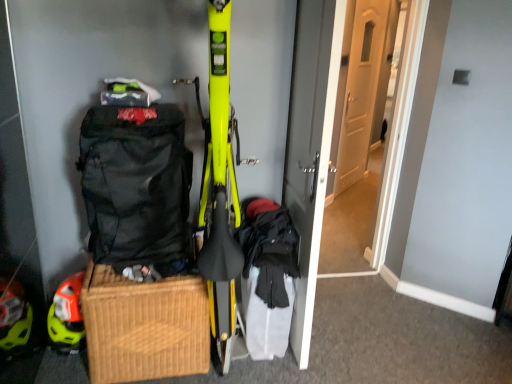
Measure the distance between white wooden door at center, which appears as the first door when viewed from the right, and camera.

8.27 feet.

In order to click on woven brown picnic basket at lower left in this screenshot , I will do `click(144, 326)`.

How much space does matte gray door at center, which is counted as the 1th door, starting from the left, occupy vertically?

matte gray door at center, which is counted as the 1th door, starting from the left, is 1.75 meters tall.

I want to click on orange matte helmet at lower left, so click(x=67, y=316).

Does white wooden door at center, which appears as the second door when viewed from the left, have a lesser height compared to matte gray door at center, which is counted as the 1th door, starting from the left?

No.

Who is more distant, white wooden door at center, which appears as the second door when viewed from the left, or matte gray door at center, which ranks as the 2th door in right-to-left order?

white wooden door at center, which appears as the second door when viewed from the left, is behind.

Which of these two, white wooden door at center, which appears as the second door when viewed from the left, or matte gray door at center, which is counted as the 1th door, starting from the left, is bigger?

matte gray door at center, which is counted as the 1th door, starting from the left, is bigger.

Are white wooden door at center, which appears as the second door when viewed from the left, and matte gray door at center, which ranks as the 2th door in right-to-left order, far apart?

Yes, white wooden door at center, which appears as the second door when viewed from the left, and matte gray door at center, which ranks as the 2th door in right-to-left order, are quite far apart.

Where is `backpack above the woven brown picnic basket at lower left (from the image's perspective)`? backpack above the woven brown picnic basket at lower left (from the image's perspective) is located at coordinates (137, 187).

Considering the relative positions of black fabric backpack at left and woven brown picnic basket at lower left in the image provided, is black fabric backpack at left in front of woven brown picnic basket at lower left?

Yes, black fabric backpack at left is closer to the viewer.

In terms of height, does black fabric backpack at left look taller or shorter compared to woven brown picnic basket at lower left?

black fabric backpack at left is taller than woven brown picnic basket at lower left.

Is black fabric backpack at left not within woven brown picnic basket at lower left?

Yes, black fabric backpack at left is located beyond the bounds of woven brown picnic basket at lower left.

How different are the orientations of matte gray door at center, which is counted as the 1th door, starting from the left, and orange matte helmet at lower left in degrees?

matte gray door at center, which is counted as the 1th door, starting from the left, and orange matte helmet at lower left are facing 87.1 degrees away from each other.

Does point (335, 11) come behind point (68, 348)?

That is False.

From a real-world perspective, between matte gray door at center, which is counted as the 1th door, starting from the left, and orange matte helmet at lower left, who is vertically higher?

In real-world perspective, matte gray door at center, which is counted as the 1th door, starting from the left, is above.

Can you confirm if matte gray door at center, which ranks as the 2th door in right-to-left order, is positioned to the right of orange matte helmet at lower left?

Yes, matte gray door at center, which ranks as the 2th door in right-to-left order, is to the right of orange matte helmet at lower left.

Is orange matte helmet at lower left aimed at white wooden door at center, which appears as the first door when viewed from the right?

No, orange matte helmet at lower left is not facing towards white wooden door at center, which appears as the first door when viewed from the right.

Which of these two, orange matte helmet at lower left or white wooden door at center, which appears as the first door when viewed from the right, is smaller?

With smaller size is orange matte helmet at lower left.

Which of these two, orange matte helmet at lower left or white wooden door at center, which appears as the first door when viewed from the right, stands shorter?

orange matte helmet at lower left.

From their relative heights in the image, would you say white wooden door at center, which appears as the first door when viewed from the right, is taller or shorter than black fabric backpack at left?

white wooden door at center, which appears as the first door when viewed from the right, is taller than black fabric backpack at left.

Is white wooden door at center, which appears as the first door when viewed from the right, positioned before black fabric backpack at left?

That is False.

Looking at the image, does white wooden door at center, which appears as the first door when viewed from the right, seem bigger or smaller compared to black fabric backpack at left?

white wooden door at center, which appears as the first door when viewed from the right, is bigger than black fabric backpack at left.

From the image's perspective, is white wooden door at center, which appears as the first door when viewed from the right, located beneath black fabric backpack at left?

Actually, white wooden door at center, which appears as the first door when viewed from the right, appears above black fabric backpack at left in the image.

Is black fabric backpack at left with orange matte helmet at lower left?

No.

Based on the photo, which object is thinner, black fabric backpack at left or orange matte helmet at lower left?

orange matte helmet at lower left is thinner.

Does black fabric backpack at left have a lesser height compared to orange matte helmet at lower left?

Incorrect, the height of black fabric backpack at left does not fall short of that of orange matte helmet at lower left.

Find the location of a particular element. backpack located in front of the orange matte helmet at lower left is located at coordinates (137, 187).

Who is smaller, orange matte helmet at lower left or black fabric backpack at left?

With smaller size is orange matte helmet at lower left.

Could black fabric backpack at left be considered to be inside orange matte helmet at lower left?

That's incorrect, black fabric backpack at left is not inside orange matte helmet at lower left.

From the image's perspective, is orange matte helmet at lower left beneath black fabric backpack at left?

Indeed, from the image's perspective, orange matte helmet at lower left is shown beneath black fabric backpack at left.

From a real-world perspective, which is physically below, orange matte helmet at lower left or black fabric backpack at left?

From a 3D spatial view, orange matte helmet at lower left is below.

Locate an element on the screen. This screenshot has width=512, height=384. door below the white wooden door at center, which appears as the first door when viewed from the right (from a real-world perspective) is located at coordinates (311, 147).

Find the location of a particular element. Image resolution: width=512 pixels, height=384 pixels. picnic basket behind the black fabric backpack at left is located at coordinates (144, 326).

When comparing their distances from white wooden door at center, which appears as the second door when viewed from the left, does black fabric backpack at left or matte gray door at center, which ranks as the 2th door in right-to-left order, seem closer?

matte gray door at center, which ranks as the 2th door in right-to-left order.

Looking at the image, which one is located closer to matte gray door at center, which is counted as the 1th door, starting from the left, black fabric backpack at left or orange matte helmet at lower left?

black fabric backpack at left is positioned closer to the anchor matte gray door at center, which is counted as the 1th door, starting from the left.

When comparing their distances from woven brown picnic basket at lower left, does matte gray door at center, which is counted as the 1th door, starting from the left, or orange matte helmet at lower left seem closer?

orange matte helmet at lower left lies closer to woven brown picnic basket at lower left than the other object.

From the picture: Looking at the image, which one is located closer to matte gray door at center, which is counted as the 1th door, starting from the left, white wooden door at center, which appears as the second door when viewed from the left, or black fabric backpack at left?

Among the two, black fabric backpack at left is located nearer to matte gray door at center, which is counted as the 1th door, starting from the left.

Estimate the real-world distances between objects in this image. Which object is closer to white wooden door at center, which appears as the second door when viewed from the left, matte gray door at center, which is counted as the 1th door, starting from the left, or orange matte helmet at lower left?

Among the two, matte gray door at center, which is counted as the 1th door, starting from the left, is located nearer to white wooden door at center, which appears as the second door when viewed from the left.

Looking at the image, which one is located further to black fabric backpack at left, orange matte helmet at lower left or white wooden door at center, which appears as the second door when viewed from the left?

white wooden door at center, which appears as the second door when viewed from the left, is positioned further to the anchor black fabric backpack at left.

Looking at the image, which one is located further to black fabric backpack at left, woven brown picnic basket at lower left or matte gray door at center, which ranks as the 2th door in right-to-left order?

matte gray door at center, which ranks as the 2th door in right-to-left order.

Considering their positions, is orange matte helmet at lower left positioned further to white wooden door at center, which appears as the second door when viewed from the left, than black fabric backpack at left?

orange matte helmet at lower left.

The width and height of the screenshot is (512, 384). I want to click on picnic basket between orange matte helmet at lower left and matte gray door at center, which ranks as the 2th door in right-to-left order, in the horizontal direction, so click(x=144, y=326).

At what (x,y) coordinates should I click in order to perform the action: click on backpack between woven brown picnic basket at lower left and white wooden door at center, which appears as the second door when viewed from the left. Please return your answer as a coordinate pair (x, y). This screenshot has width=512, height=384. Looking at the image, I should click on (137, 187).

At what (x,y) coordinates should I click in order to perform the action: click on door between woven brown picnic basket at lower left and white wooden door at center, which appears as the second door when viewed from the left, in the horizontal direction. Please return your answer as a coordinate pair (x, y). Looking at the image, I should click on (311, 147).

Identify the location of backpack between woven brown picnic basket at lower left and matte gray door at center, which ranks as the 2th door in right-to-left order. The height and width of the screenshot is (384, 512). (137, 187).